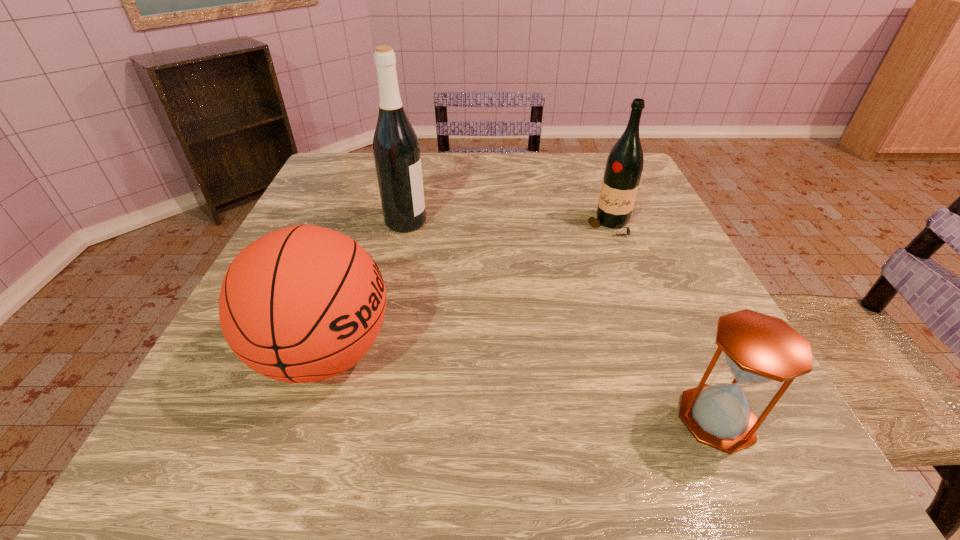
Find the location of a particular element. This screenshot has height=540, width=960. the tallest object is located at coordinates (396, 150).

This screenshot has height=540, width=960. What are the coordinates of `the taller wine bottle` in the screenshot? It's located at (396, 150).

This screenshot has height=540, width=960. I want to click on the right wine bottle, so click(624, 165).

In order to click on the second tallest object in this screenshot , I will do `click(624, 165)`.

Identify the location of the second shortest object. (301, 304).

Find the location of a particular element. Image resolution: width=960 pixels, height=540 pixels. the shortest object is located at coordinates 758,348.

At what (x,y) coordinates should I click in order to perform the action: click on free space located on the label of the left wine bottle. Please return your answer as a coordinate pair (x, y). Looking at the image, I should click on (525, 222).

The image size is (960, 540). Identify the location of free space located on the left of the second tallest object. (444, 226).

Find the location of a particular element. The image size is (960, 540). free point located on the side with logo of the third tallest object is located at coordinates (467, 353).

Where is `vacant region located 0.150m on the left of the hourglass`? This screenshot has height=540, width=960. vacant region located 0.150m on the left of the hourglass is located at coordinates (576, 418).